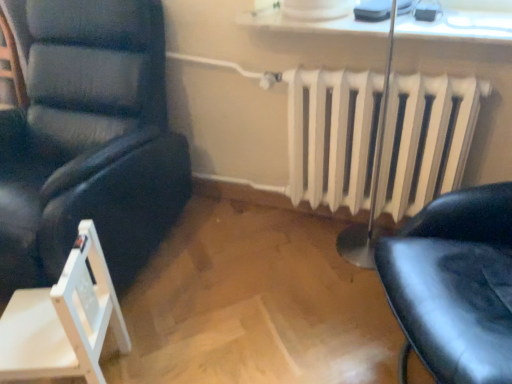
Where is `white painted metal radiator at center`? white painted metal radiator at center is located at coordinates (329, 136).

Describe the element at coordinates (89, 141) in the screenshot. Image resolution: width=512 pixels, height=384 pixels. I see `matte black chair at left, which is counted as the first chair, starting from the top` at that location.

What is the approximate height of white glossy window sill at upper center?

white glossy window sill at upper center is 2.18 inches tall.

The height and width of the screenshot is (384, 512). In order to click on white glossy window sill at upper center in this screenshot , I will do `click(457, 25)`.

Where is `white painted metal radiator at center`? The height and width of the screenshot is (384, 512). white painted metal radiator at center is located at coordinates (329, 136).

Which object is closer to the camera taking this photo, white wood folding chair at lower left, marked as the second chair in a top-to-bottom arrangement, or white painted metal radiator at center?

white wood folding chair at lower left, marked as the second chair in a top-to-bottom arrangement.

Do you think white wood folding chair at lower left, marked as the second chair in a top-to-bottom arrangement, is within white painted metal radiator at center, or outside of it?

white wood folding chair at lower left, marked as the second chair in a top-to-bottom arrangement, is not inside white painted metal radiator at center, it's outside.

Where is `radiator located above the white wood folding chair at lower left, marked as the second chair in a top-to-bottom arrangement (from the image's perspective)`? Image resolution: width=512 pixels, height=384 pixels. radiator located above the white wood folding chair at lower left, marked as the second chair in a top-to-bottom arrangement (from the image's perspective) is located at coordinates (329, 136).

Is white glossy window sill at upper center to the right of matte black chair at left, which is counted as the first chair, starting from the top, from the viewer's perspective?

Yes, white glossy window sill at upper center is to the right of matte black chair at left, which is counted as the first chair, starting from the top.

Considering the relative sizes of white glossy window sill at upper center and matte black chair at left, which is the 2th chair in bottom-to-top order, in the image provided, is white glossy window sill at upper center bigger than matte black chair at left, which is the 2th chair in bottom-to-top order,?

Actually, white glossy window sill at upper center might be smaller than matte black chair at left, which is the 2th chair in bottom-to-top order.

Considering the positions of point (373, 34) and point (60, 14), is point (373, 34) closer or farther from the camera than point (60, 14)?

Point (373, 34) is positioned closer to the camera compared to point (60, 14).

From the image's perspective, is white glossy window sill at upper center located beneath matte black chair at left, which is the 2th chair in bottom-to-top order?

Incorrect, from the image's perspective, white glossy window sill at upper center is higher than matte black chair at left, which is the 2th chair in bottom-to-top order.

From the image's perspective, between white painted metal radiator at center and matte black chair at left, which is counted as the first chair, starting from the top, which one is located above?

matte black chair at left, which is counted as the first chair, starting from the top, is shown above in the image.

How distant is white painted metal radiator at center from matte black chair at left, which is the 2th chair in bottom-to-top order?

white painted metal radiator at center is 31.24 inches from matte black chair at left, which is the 2th chair in bottom-to-top order.

Considering the sizes of objects white painted metal radiator at center and matte black chair at left, which is counted as the first chair, starting from the top, in the image provided, who is taller, white painted metal radiator at center or matte black chair at left, which is counted as the first chair, starting from the top,?

matte black chair at left, which is counted as the first chair, starting from the top, is taller.

In the image, is white painted metal radiator at center on the left side or the right side of matte black chair at left, which is counted as the first chair, starting from the top?

From the image, it's evident that white painted metal radiator at center is to the right of matte black chair at left, which is counted as the first chair, starting from the top.

From the image's perspective, is white glossy window sill at upper center under white painted metal radiator at center?

Incorrect, from the image's perspective, white glossy window sill at upper center is higher than white painted metal radiator at center.

Is white glossy window sill at upper center aimed at white painted metal radiator at center?

No, white glossy window sill at upper center is not turned towards white painted metal radiator at center.

Would you say white glossy window sill at upper center contains white painted metal radiator at center?

No, white glossy window sill at upper center does not contain white painted metal radiator at center.

Can you confirm if white glossy window sill at upper center is smaller than white painted metal radiator at center?

Correct, white glossy window sill at upper center occupies less space than white painted metal radiator at center.

Considering the positions of objects white wood folding chair at lower left, the first chair ordered from the bottom, and matte black chair at left, which is the 2th chair in bottom-to-top order, in the image provided, who is more to the left, white wood folding chair at lower left, the first chair ordered from the bottom, or matte black chair at left, which is the 2th chair in bottom-to-top order,?

From the viewer's perspective, matte black chair at left, which is the 2th chair in bottom-to-top order, appears more on the left side.

What's the angular difference between white wood folding chair at lower left, the first chair ordered from the bottom, and matte black chair at left, which is the 2th chair in bottom-to-top order,'s facing directions?

There is a 70.9-degree angle between the facing directions of white wood folding chair at lower left, the first chair ordered from the bottom, and matte black chair at left, which is the 2th chair in bottom-to-top order.

From a real-world perspective, which is physically below, matte black chair at left, which is counted as the first chair, starting from the top, or white painted metal radiator at center?

From a 3D spatial view, white painted metal radiator at center is below.

Does matte black chair at left, which is the 2th chair in bottom-to-top order, lie behind white painted metal radiator at center?

That is False.

Between matte black chair at left, which is the 2th chair in bottom-to-top order, and white painted metal radiator at center, which one has more height?

Standing taller between the two is matte black chair at left, which is the 2th chair in bottom-to-top order.

Between point (52, 178) and point (312, 107), which one is positioned in front?

Positioned in front is point (52, 178).

Which is more to the left, white glossy window sill at upper center or white wood folding chair at lower left, marked as the second chair in a top-to-bottom arrangement?

white wood folding chair at lower left, marked as the second chair in a top-to-bottom arrangement.

Which is more distant, (371,31) or (88,255)?

The point (371,31) is farther.

From a real-world perspective, which is physically below, white glossy window sill at upper center or white wood folding chair at lower left, the first chair ordered from the bottom?

From a 3D spatial view, white wood folding chair at lower left, the first chair ordered from the bottom, is below.

Where is `radiator on the right of white wood folding chair at lower left, the first chair ordered from the bottom`? The width and height of the screenshot is (512, 384). radiator on the right of white wood folding chair at lower left, the first chair ordered from the bottom is located at coordinates (329, 136).

There is a matte black chair at left, which is counted as the first chair, starting from the top. At what (x,y) coordinates should I click in order to perform the action: click on window sill above it (from a real-world perspective). Please return your answer as a coordinate pair (x, y). This screenshot has width=512, height=384. Looking at the image, I should click on (457, 25).

From the image, which object appears to be nearer to white painted metal radiator at center, white wood folding chair at lower left, the first chair ordered from the bottom, or white glossy window sill at upper center?

white glossy window sill at upper center is positioned closer to the anchor white painted metal radiator at center.

Based on their spatial positions, is matte black chair at left, which is the 2th chair in bottom-to-top order, or white wood folding chair at lower left, marked as the second chair in a top-to-bottom arrangement, further from white glossy window sill at upper center?

Among the two, white wood folding chair at lower left, marked as the second chair in a top-to-bottom arrangement, is located further to white glossy window sill at upper center.

From the image, which object appears to be nearer to white wood folding chair at lower left, marked as the second chair in a top-to-bottom arrangement, white painted metal radiator at center or matte black chair at left, which is counted as the first chair, starting from the top?

matte black chair at left, which is counted as the first chair, starting from the top, is closer to white wood folding chair at lower left, marked as the second chair in a top-to-bottom arrangement.

From the image, which object appears to be farther from matte black chair at left, which is counted as the first chair, starting from the top, white painted metal radiator at center or white wood folding chair at lower left, marked as the second chair in a top-to-bottom arrangement?

The object further to matte black chair at left, which is counted as the first chair, starting from the top, is white painted metal radiator at center.

Which object lies nearer to the anchor point white painted metal radiator at center, white glossy window sill at upper center or matte black chair at left, which is counted as the first chair, starting from the top?

white glossy window sill at upper center is closer to white painted metal radiator at center.

Based on their spatial positions, is white glossy window sill at upper center or matte black chair at left, which is the 2th chair in bottom-to-top order, closer to white wood folding chair at lower left, marked as the second chair in a top-to-bottom arrangement?

Among the two, matte black chair at left, which is the 2th chair in bottom-to-top order, is located nearer to white wood folding chair at lower left, marked as the second chair in a top-to-bottom arrangement.

From the image, which object appears to be nearer to white painted metal radiator at center, white wood folding chair at lower left, marked as the second chair in a top-to-bottom arrangement, or matte black chair at left, which is the 2th chair in bottom-to-top order?

matte black chair at left, which is the 2th chair in bottom-to-top order, is closer to white painted metal radiator at center.

Looking at the image, which one is located closer to matte black chair at left, which is the 2th chair in bottom-to-top order, white glossy window sill at upper center or white wood folding chair at lower left, the first chair ordered from the bottom?

The object closer to matte black chair at left, which is the 2th chair in bottom-to-top order, is white wood folding chair at lower left, the first chair ordered from the bottom.

Find the location of a particular element. The height and width of the screenshot is (384, 512). chair situated between matte black chair at left, which is the 2th chair in bottom-to-top order, and white painted metal radiator at center from left to right is located at coordinates (64, 320).

I want to click on window sill between matte black chair at left, which is counted as the first chair, starting from the top, and white painted metal radiator at center, so click(x=457, y=25).

The height and width of the screenshot is (384, 512). I want to click on window sill between white wood folding chair at lower left, the first chair ordered from the bottom, and white painted metal radiator at center, so click(x=457, y=25).

Find the location of a particular element. This screenshot has height=384, width=512. chair between matte black chair at left, which is the 2th chair in bottom-to-top order, and white glossy window sill at upper center, in the horizontal direction is located at coordinates (64, 320).